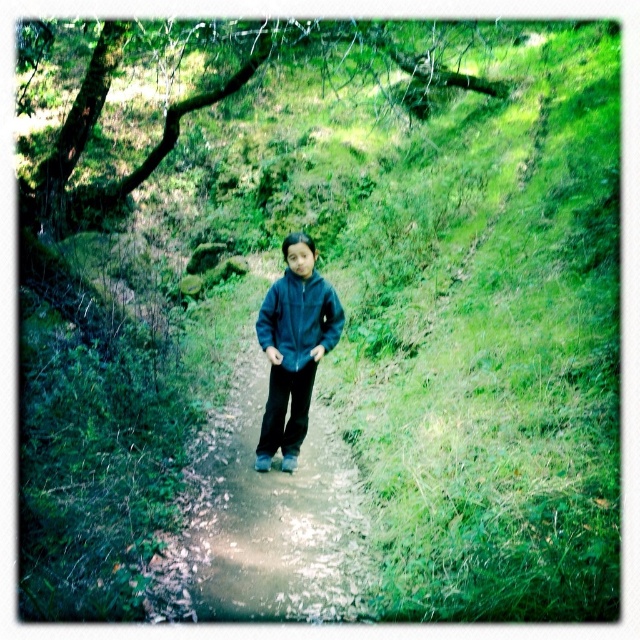
Does dark blue fleece jacket at center appear on the right side of matte blue jacket at center?

Incorrect, dark blue fleece jacket at center is not on the right side of matte blue jacket at center.

Who is more distant from viewer, (284, 276) or (324, 330)?

The point (284, 276) is behind.

Find the location of a particular element. The height and width of the screenshot is (640, 640). dark blue fleece jacket at center is located at coordinates (292, 348).